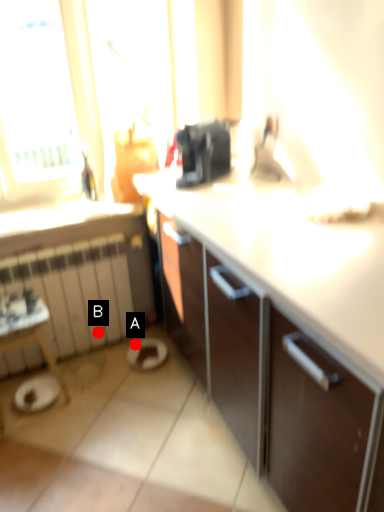
Question: Two points are circled on the image, labeled by A and B beside each circle. Among these points, which one is nearest to the camera?

Choices:
 (A) A is closer
 (B) B is closer

Answer: (B)